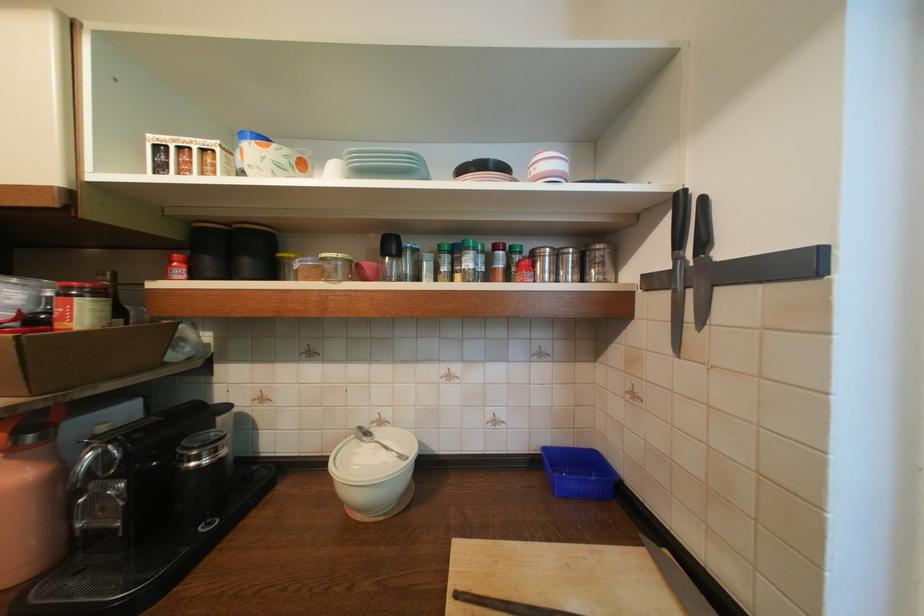
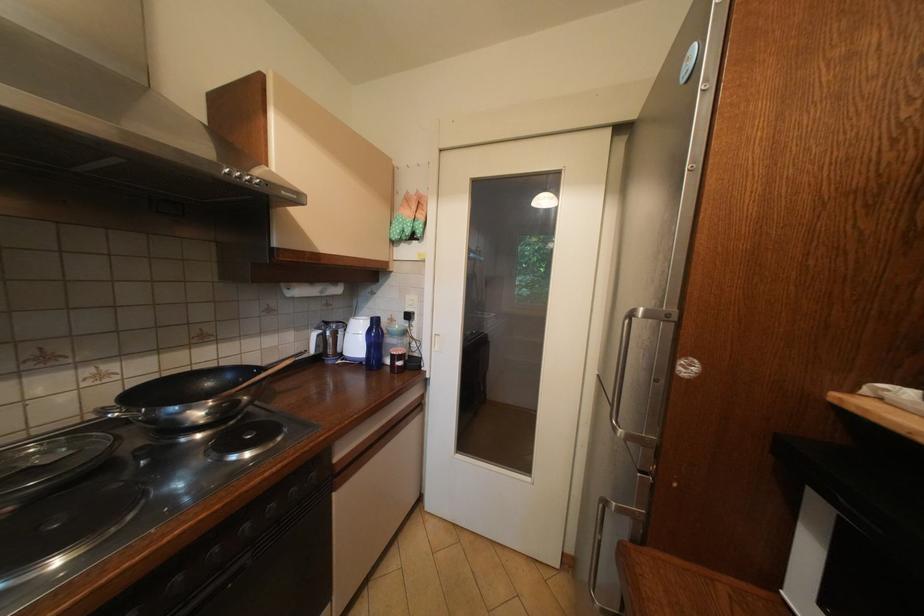
Question: The camera is either moving clockwise (left) or counter-clockwise (right) around the object. The first image is from the beginning of the video and the second image is from the end. Is the camera moving left or right when shooting the video?

Choices:
 (A) Left
 (B) Right

Answer: (B)